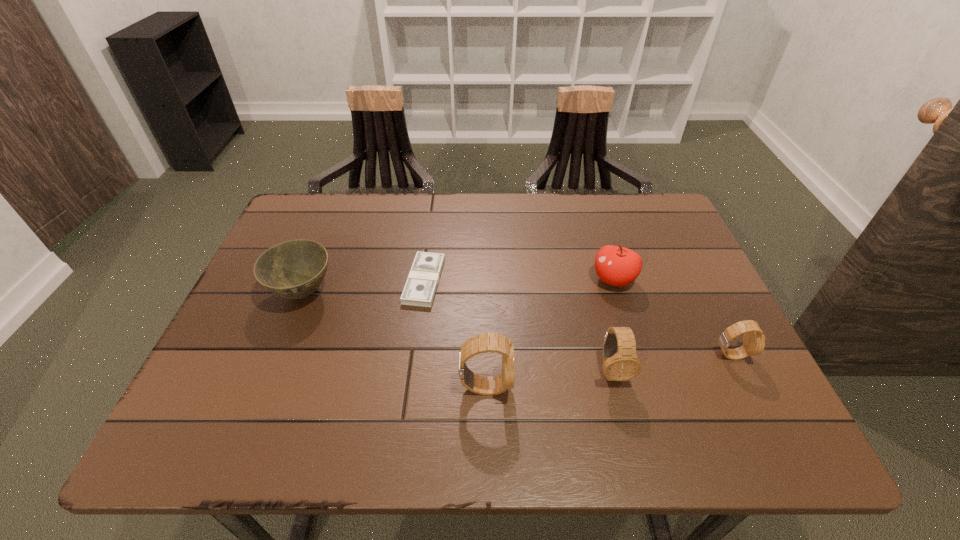
Locate an element on the screen. The height and width of the screenshot is (540, 960). object identified as the closest to the leftmost object is located at coordinates (422, 281).

This screenshot has height=540, width=960. Identify the location of object that ranks as the closest to the dollar. (294, 269).

Identify which watch is located as the nearest to the tallest object. Please provide its 2D coordinates. Your answer should be formatted as a tuple, i.e. [(x, y)], where the tuple contains the x and y coordinates of a point satisfying the conditions above.

[(620, 362)]

Select which watch appears as the closest to the third object from left to right. Please provide its 2D coordinates. Your answer should be formatted as a tuple, i.e. [(x, y)], where the tuple contains the x and y coordinates of a point satisfying the conditions above.

[(620, 362)]

The height and width of the screenshot is (540, 960). Identify the location of blank space that satisfies the following two spatial constraints: 1. on the face of the second shortest watch; 2. on the face of the leftmost watch. (616, 387).

This screenshot has width=960, height=540. In order to click on vacant space that satisfies the following two spatial constraints: 1. on the face of the second tallest watch; 2. on the face of the tallest watch in this screenshot , I will do `click(616, 387)`.

Identify the location of vacant space that satisfies the following two spatial constraints: 1. on the face of the second shortest watch; 2. on the face of the fourth object from right to left. This screenshot has width=960, height=540. (616, 387).

At what (x,y) coordinates should I click in order to perform the action: click on free space that satisfies the following two spatial constraints: 1. on the face of the rightmost watch; 2. on the face of the second shortest watch. Please return your answer as a coordinate pair (x, y). Looking at the image, I should click on (738, 370).